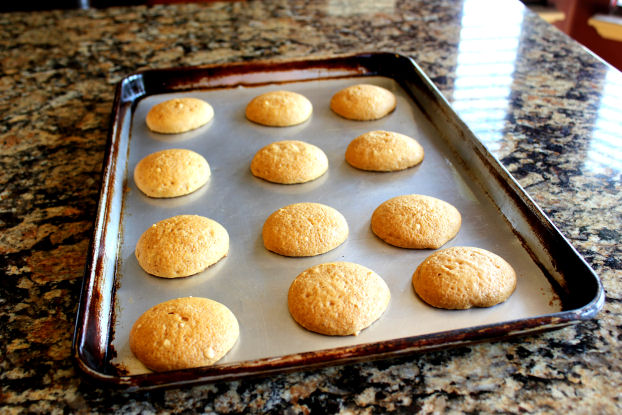
Find the location of a particular element. The image size is (622, 415). blackened edges of pan is located at coordinates (160, 77).